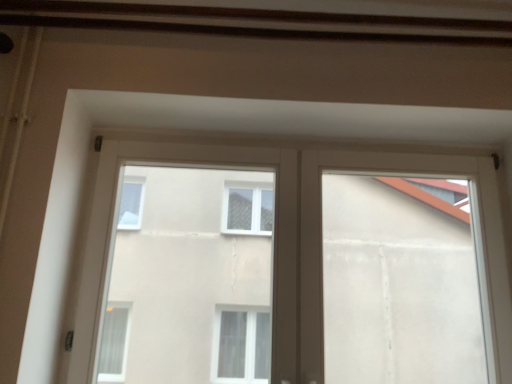
Image resolution: width=512 pixels, height=384 pixels. Describe the element at coordinates (296, 244) in the screenshot. I see `transparent glass window at center` at that location.

This screenshot has height=384, width=512. I want to click on white plastic window frame at upper center, so click(x=400, y=282).

From a real-world perspective, who is located higher, white plastic window frame at upper center or transparent glass window at center?

From a 3D spatial view, transparent glass window at center is above.

From the image's perspective, between white plastic window frame at upper center and transparent glass window at center, who is located below?

white plastic window frame at upper center is shown below in the image.

Is white plastic window frame at upper center shorter than transparent glass window at center?

Indeed, white plastic window frame at upper center has a lesser height compared to transparent glass window at center.

Considering the sizes of white plastic window frame at upper center and transparent glass window at center in the image, is white plastic window frame at upper center bigger or smaller than transparent glass window at center?

In the image, white plastic window frame at upper center appears to be larger than transparent glass window at center.

Who is more distant, transparent glass window at center or white plastic window frame at upper center?

transparent glass window at center is behind.

Is transparent glass window at center turned away from white plastic window frame at upper center?

Absolutely, transparent glass window at center is directed away from white plastic window frame at upper center.

Can you confirm if transparent glass window at center is positioned to the right of white plastic window frame at upper center?

No, transparent glass window at center is not to the right of white plastic window frame at upper center.

How many degrees apart are the facing directions of transparent glass window at center and white plastic window frame at upper center?

2.33 degrees separate the facing orientations of transparent glass window at center and white plastic window frame at upper center.

Considering the points (124, 365) and (499, 321), which point is behind, point (124, 365) or point (499, 321)?

The point (124, 365) is more distant.

Is white plastic window at upper center bigger than transparent glass window at center?

Correct, white plastic window at upper center is larger in size than transparent glass window at center.

Can you see white plastic window at upper center touching transparent glass window at center?

No, white plastic window at upper center is not in contact with transparent glass window at center.

Is white plastic window at upper center inside or outside of transparent glass window at center?

white plastic window at upper center is inside transparent glass window at center.

Would you say transparent glass window at center contains white plastic window at upper center?

Absolutely, white plastic window at upper center is inside transparent glass window at center.

Is transparent glass window at center in front of or behind white plastic window at upper center in the image?

Clearly, transparent glass window at center is behind white plastic window at upper center.

Are transparent glass window at center and white plastic window at upper center beside each other?

No, transparent glass window at center is not in contact with white plastic window at upper center.

From a real-world perspective, is transparent glass window at center positioned above or below white plastic window at upper center?

Clearly, from a real-world perspective, transparent glass window at center is above white plastic window at upper center.

Can you confirm if white plastic window at upper center is positioned to the right of white plastic window frame at upper center?

Incorrect, white plastic window at upper center is not on the right side of white plastic window frame at upper center.

Does white plastic window at upper center have a smaller size compared to white plastic window frame at upper center?

Correct, white plastic window at upper center occupies less space than white plastic window frame at upper center.

Find the location of a particular element. This screenshot has height=384, width=512. window frame behind the white plastic window at upper center is located at coordinates (400, 282).

Based on the photo, is white plastic window at upper center positioned with its back to white plastic window frame at upper center?

white plastic window at upper center is not turned away from white plastic window frame at upper center.

Is white plastic window frame at upper center wider or thinner than white plastic window at upper center?

Considering their sizes, white plastic window frame at upper center looks broader than white plastic window at upper center.

Is white plastic window frame at upper center aimed at white plastic window at upper center?

No, white plastic window frame at upper center is not turned towards white plastic window at upper center.

From a real-world perspective, who is located higher, white plastic window frame at upper center or white plastic window at upper center?

white plastic window frame at upper center, from a real-world perspective.

What's the angular difference between white plastic window frame at upper center and white plastic window at upper center's facing directions?

The angular difference between white plastic window frame at upper center and white plastic window at upper center is 2.86 degrees.

The width and height of the screenshot is (512, 384). Find the location of `window frame that appears below the transparent glass window at center (from the image's perspective)`. window frame that appears below the transparent glass window at center (from the image's perspective) is located at coordinates (400, 282).

This screenshot has width=512, height=384. I want to click on window frame in front of the transparent glass window at center, so click(400, 282).

From the image, which object appears to be farther from white plastic window frame at upper center, white plastic window at upper center or transparent glass window at center?

white plastic window at upper center.

When comparing their distances from transparent glass window at center, does white plastic window frame at upper center or white plastic window at upper center seem further?

white plastic window at upper center is further to transparent glass window at center.

Consider the image. Considering their positions, is white plastic window frame at upper center positioned closer to white plastic window at upper center than transparent glass window at center?

white plastic window frame at upper center lies closer to white plastic window at upper center than the other object.

Looking at the image, which one is located closer to white plastic window at upper center, transparent glass window at center or white plastic window frame at upper center?

white plastic window frame at upper center.

When comparing their distances from white plastic window frame at upper center, does transparent glass window at center or white plastic window at upper center seem further?

white plastic window at upper center is positioned further to the anchor white plastic window frame at upper center.

Considering their positions, is white plastic window at upper center positioned closer to transparent glass window at center than white plastic window frame at upper center?

white plastic window frame at upper center is closer to transparent glass window at center.

Find the location of `window located between white plastic window at upper center and white plastic window frame at upper center in the left-right direction`. window located between white plastic window at upper center and white plastic window frame at upper center in the left-right direction is located at coordinates (296, 244).